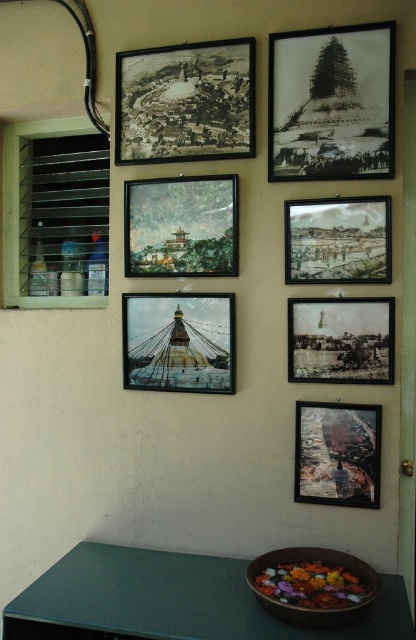
Question: Which point appears farthest from the camera in this image?

Choices:
 (A) (205, 246)
 (B) (304, 269)
 (C) (200, 358)
 (D) (326, 308)

Answer: (C)

Question: Is the position of black paper photograph at upper right less distant than that of matte paper painting at center?

Choices:
 (A) no
 (B) yes

Answer: (B)

Question: Which object is farther from the camera taking this photo?

Choices:
 (A) green glossy table at lower left
 (B) black paper map at upper left
 (C) black paper photograph at center

Answer: (B)

Question: Which is nearer to the black paper photograph at center?

Choices:
 (A) green glossy table at lower left
 (B) black paper map at upper left
 (C) black paper photograph at upper right
 (D) watercolor paper painting at center

Answer: (D)

Question: Does green glossy table at lower left appear on the right side of black paper photograph at center?

Choices:
 (A) no
 (B) yes

Answer: (A)

Question: From the image, what is the correct spatial relationship of green glossy table at lower left in relation to metallic gold stupa at center?

Choices:
 (A) above
 (B) below

Answer: (B)